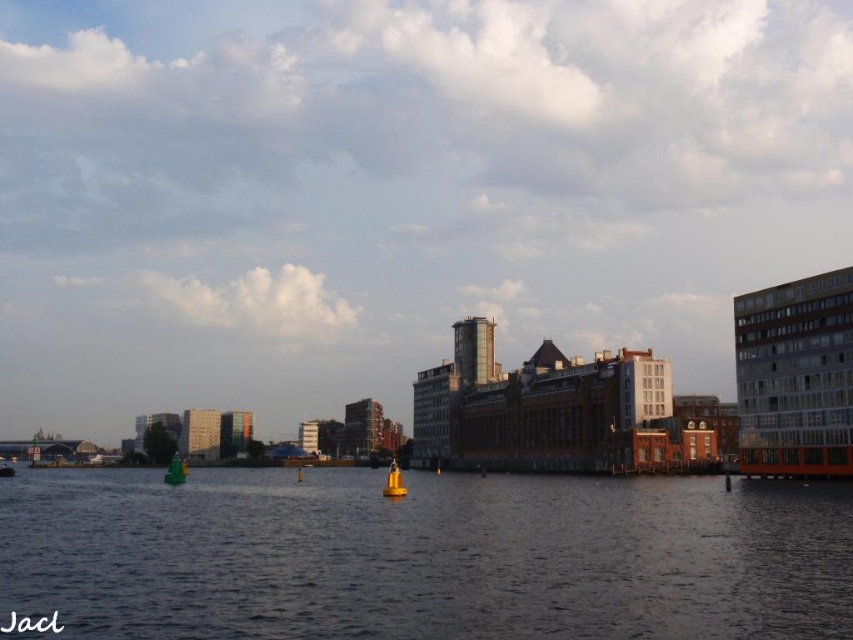
Does dark blue water at center appear over green plastic boat at lower left?

Correct, dark blue water at center is located above green plastic boat at lower left.

Does dark blue water at center have a larger size compared to green plastic boat at lower left?

No, dark blue water at center is not bigger than green plastic boat at lower left.

Where is `dark blue water at center`? The width and height of the screenshot is (853, 640). dark blue water at center is located at coordinates (424, 556).

Image resolution: width=853 pixels, height=640 pixels. What are the coordinates of `dark blue water at center` in the screenshot? It's located at click(424, 556).

Can you confirm if dark blue water at center is positioned above yellow matte buoy at center?

Indeed, dark blue water at center is positioned over yellow matte buoy at center.

Is point (664, 589) more distant than point (383, 493)?

No, (664, 589) is closer to viewer.

Between point (572, 483) and point (387, 496), which one is positioned behind?

The point (572, 483) is behind.

Find the location of a particular element. This screenshot has height=640, width=853. dark blue water at center is located at coordinates (424, 556).

Consider the image. Measure the distance between yellow matte buoy at center and camera.

The distance of yellow matte buoy at center from camera is 84.82 meters.

Which is more to the left, yellow matte buoy at center or green plastic boat at lower left?

green plastic boat at lower left is more to the left.

The width and height of the screenshot is (853, 640). Find the location of `yellow matte buoy at center`. yellow matte buoy at center is located at coordinates (393, 483).